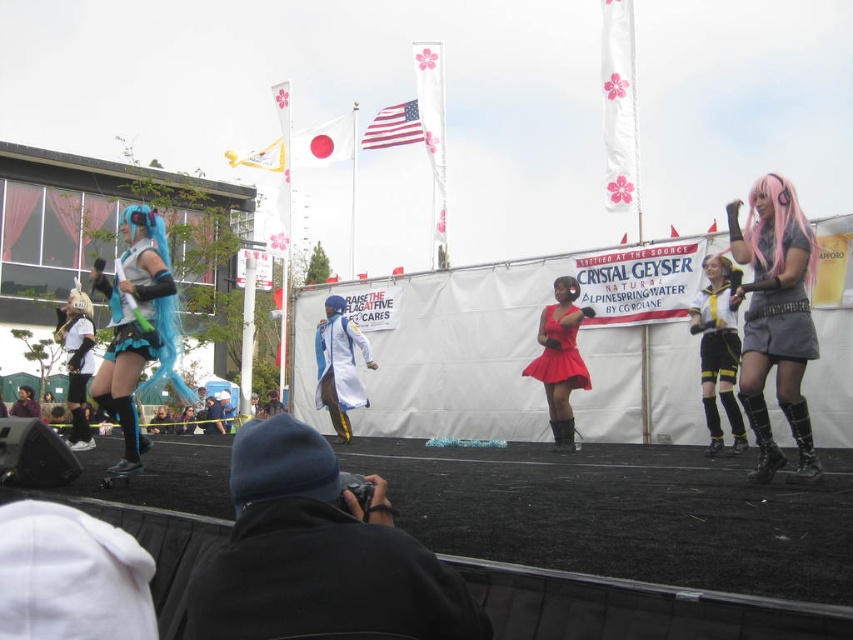
You are a photographer at the event and want to take a clear photo of the shiny red skirt at center without the pink synthetic wig at upper right blocking it. What should you do?

The pink synthetic wig at upper right is in front of the shiny red skirt at center, so you should adjust your position or angle to move the pink synthetic wig at upper right out of the frame or wait until the performers move so the shiny red skirt at center is visible.

You are standing at the point labeled as point (538, 362) and want to move towards the photographer who is at point (717, 337). Is the photographer closer to you than the stage backdrop?

Point (717, 337) is closer to the viewer than point (538, 362), so the photographer at point (717, 337) is closer to you than the stage backdrop at point (538, 362).

You are standing at the event and want to take a photo of the banner that says Raise the Flag at Five. The camera you are holding is at point point (787, 220). Is the banner that says Raise the Flag at Five within the camera view?

The point (787, 220) is 17.61 feet from viewer, so the banner that says Raise the Flag at Five is within the camera view.